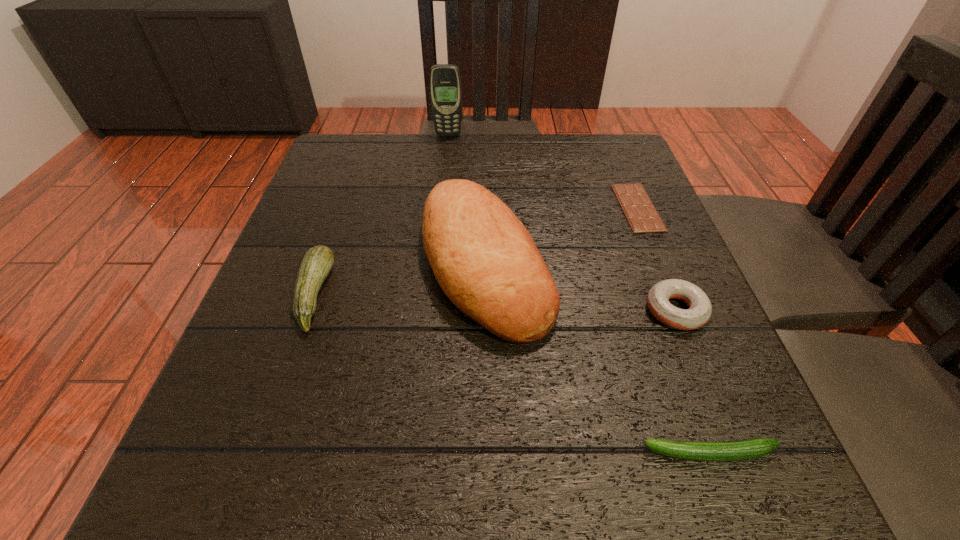
You are a GUI agent. You are given a task and a screenshot of the screen. Output one action in this format:
    pyautogui.click(x=<x>, y=<y>)
    Task: Click on the vacant position located on the left of the second tallest object
    The width and height of the screenshot is (960, 540).
    Given the screenshot: What is the action you would take?
    pyautogui.click(x=314, y=264)

The width and height of the screenshot is (960, 540). I want to click on vacant space situated 0.370m at the stem end of the leftmost object, so click(x=540, y=295).

Image resolution: width=960 pixels, height=540 pixels. I want to click on free space located on the left of the third shortest object, so click(422, 310).

You are a GUI agent. You are given a task and a screenshot of the screen. Output one action in this format:
    pyautogui.click(x=<x>, y=<y>)
    Task: Click on the free spot located 0.280m on the front-facing side of the nearer zucchini
    The height and width of the screenshot is (540, 960).
    Given the screenshot: What is the action you would take?
    pyautogui.click(x=431, y=453)

Identify the location of vacant space situated 0.150m on the front-facing side of the nearer zucchini. (529, 453).

The height and width of the screenshot is (540, 960). What are the coordinates of `vacant space situated 0.110m on the front-facing side of the nearer zucchini` in the screenshot? It's located at (560, 453).

Find the location of `vacant space located 0.400m on the left of the chocolate bar`. vacant space located 0.400m on the left of the chocolate bar is located at coordinates (433, 207).

Find the location of `cellular telephone that is at the far edge`. cellular telephone that is at the far edge is located at coordinates (445, 83).

Identify the location of chocolate bar present at the far edge. This screenshot has width=960, height=540. (642, 216).

You are a GUI agent. You are given a task and a screenshot of the screen. Output one action in this format:
    pyautogui.click(x=<x>, y=<y>)
    Task: Click on the object that is at the near edge
    The height and width of the screenshot is (540, 960).
    Given the screenshot: What is the action you would take?
    752,448